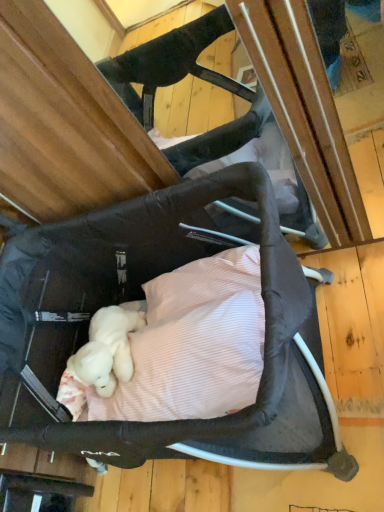
I want to click on black fabric infant bed at center, so click(x=141, y=295).

The height and width of the screenshot is (512, 384). What do you see at coordinates (141, 295) in the screenshot?
I see `black fabric infant bed at center` at bounding box center [141, 295].

At what (x,y) coordinates should I click in order to perform the action: click on black fabric infant bed at center. Please return your answer as a coordinate pair (x, y). The height and width of the screenshot is (512, 384). Looking at the image, I should click on (141, 295).